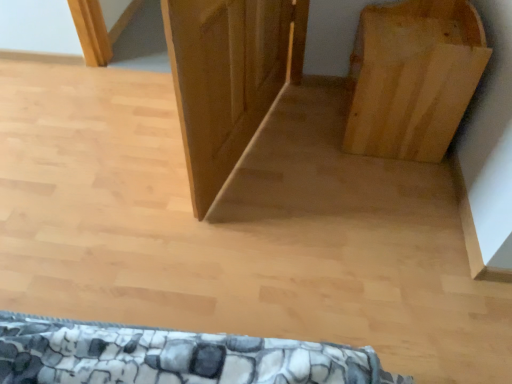
In order to face wooden door at center, should I rotate leftwards or rightwards?

You should rotate right by 0.215 degrees.

You are a GUI agent. You are given a task and a screenshot of the screen. Output one action in this format:
    pyautogui.click(x=<x>, y=<y>)
    Task: Click on the wooden door at center
    This screenshot has width=512, height=384.
    Given the screenshot: What is the action you would take?
    pyautogui.click(x=228, y=77)

What do you see at coordinates (228, 77) in the screenshot? I see `wooden door at center` at bounding box center [228, 77].

Image resolution: width=512 pixels, height=384 pixels. Describe the element at coordinates (413, 77) in the screenshot. I see `natural wood bookshelf at right` at that location.

At what (x,y) coordinates should I click in order to perform the action: click on natural wood bookshelf at right. Please return your answer as a coordinate pair (x, y). Looking at the image, I should click on (413, 77).

I want to click on wooden door at center, so click(x=228, y=77).

Would you say wooden door at center is to the left or to the right of natural wood bookshelf at right in the picture?

From the image, it's evident that wooden door at center is to the left of natural wood bookshelf at right.

Which object is closer to the camera taking this photo, wooden door at center or natural wood bookshelf at right?

wooden door at center is closer to the camera.

Which is closer, (x=200, y=50) or (x=376, y=114)?

Point (x=200, y=50) is positioned closer to the camera compared to point (x=376, y=114).

From the image's perspective, which is above, wooden door at center or natural wood bookshelf at right?

From the image's view, natural wood bookshelf at right is above.

From a real-world perspective, which object stands above the other?

In real-world perspective, wooden door at center is above.

Which of these two, wooden door at center or natural wood bookshelf at right, is thinner?

wooden door at center.

Is wooden door at center taller or shorter than natural wood bookshelf at right?

Considering their sizes, wooden door at center has more height than natural wood bookshelf at right.

Between wooden door at center and natural wood bookshelf at right, which one has larger size?

natural wood bookshelf at right.

Is wooden door at center inside or outside of natural wood bookshelf at right?

wooden door at center is located beyond the bounds of natural wood bookshelf at right.

Would you say wooden door at center is a long distance from natural wood bookshelf at right?

They are positioned close to each other.

Does wooden door at center turn towards natural wood bookshelf at right?

No.

Measure the distance from wooden door at center to natural wood bookshelf at right.

They are 21.59 inches apart.

Find the location of a particular element. The image size is (512, 384). furniture below the wooden door at center (from a real-world perspective) is located at coordinates (413, 77).

Would you say natural wood bookshelf at right is to the left or to the right of wooden door at center in the picture?

In the image, natural wood bookshelf at right appears on the right side of wooden door at center.

Between natural wood bookshelf at right and wooden door at center, which one is positioned behind?

natural wood bookshelf at right is further away from the camera.

Considering the points (418, 141) and (216, 51), which point is in front, point (418, 141) or point (216, 51)?

The point (216, 51) is closer.

From the image's perspective, is natural wood bookshelf at right over wooden door at center?

Yes.

From the picture: From a real-world perspective, does natural wood bookshelf at right stand above wooden door at center?

No.

Can you confirm if natural wood bookshelf at right is wider than wooden door at center?

Yes.

Is natural wood bookshelf at right taller or shorter than wooden door at center?

Clearly, natural wood bookshelf at right is shorter compared to wooden door at center.

Who is smaller, natural wood bookshelf at right or wooden door at center?

Smaller between the two is wooden door at center.

Is natural wood bookshelf at right spatially inside wooden door at center, or outside of it?

natural wood bookshelf at right cannot be found inside wooden door at center.

Is natural wood bookshelf at right in contact with wooden door at center?

No, natural wood bookshelf at right is not touching wooden door at center.

Is natural wood bookshelf at right facing away from wooden door at center?

No.

How different are the orientations of natural wood bookshelf at right and wooden door at center in degrees?

The facing directions of natural wood bookshelf at right and wooden door at center are 13.9 degrees apart.

How far apart are natural wood bookshelf at right and wooden door at center?

natural wood bookshelf at right is 21.59 inches away from wooden door at center.

You are a GUI agent. You are given a task and a screenshot of the screen. Output one action in this format:
    pyautogui.click(x=<x>, y=<y>)
    Task: Click on the door above the natural wood bookshelf at right (from a real-world perspective)
    The width and height of the screenshot is (512, 384).
    Given the screenshot: What is the action you would take?
    pyautogui.click(x=228, y=77)

I want to click on furniture that is on the right side of wooden door at center, so (x=413, y=77).

In the image, there is a wooden door at center. Find the location of `furniture below it (from a real-world perspective)`. furniture below it (from a real-world perspective) is located at coordinates (413, 77).